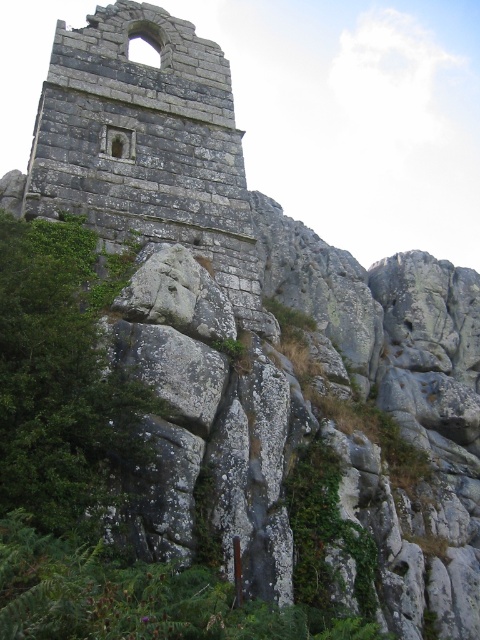
Is rusty stone ruins at center wider than green leafy tree at lower left?

Yes.

This screenshot has width=480, height=640. Describe the element at coordinates (146, 145) in the screenshot. I see `rusty stone ruins at center` at that location.

Image resolution: width=480 pixels, height=640 pixels. I want to click on rusty stone ruins at center, so click(146, 145).